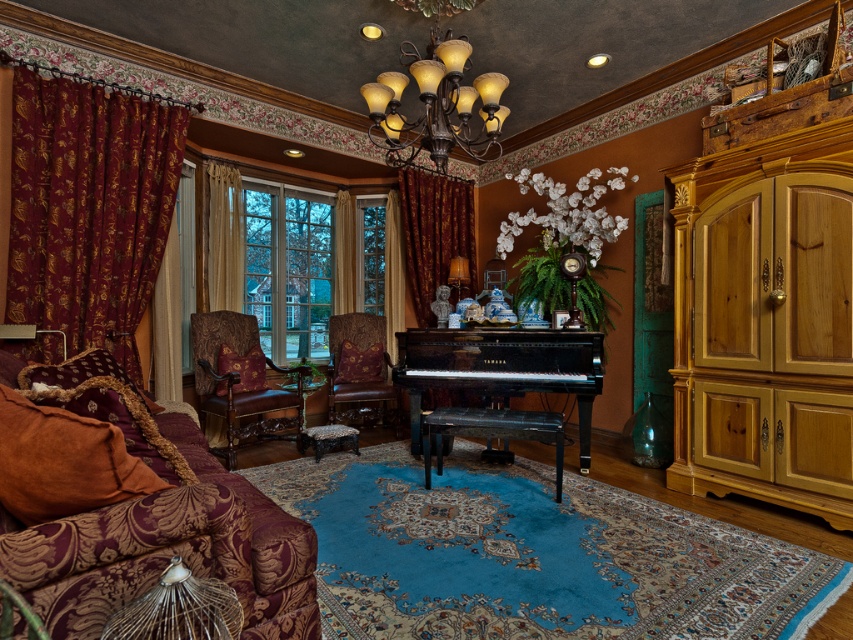
Does light brown wood armoire at right appear over velvet burgundy couch at left?

Correct, light brown wood armoire at right is located above velvet burgundy couch at left.

Who is more distant from viewer, (724,397) or (252,624)?

Positioned behind is point (724,397).

Is point (706, 204) farther from camera compared to point (93, 609)?

That is True.

Image resolution: width=853 pixels, height=640 pixels. Find the location of `light brown wood armoire at right`. light brown wood armoire at right is located at coordinates pyautogui.click(x=764, y=321).

Who is lower down, light brown wood armoire at right or velvet burgundy curtain at center?

light brown wood armoire at right

Does light brown wood armoire at right appear over velvet burgundy curtain at center?

Incorrect, light brown wood armoire at right is not positioned above velvet burgundy curtain at center.

This screenshot has width=853, height=640. What do you see at coordinates (764, 321) in the screenshot?
I see `light brown wood armoire at right` at bounding box center [764, 321].

In order to click on light brown wood armoire at right in this screenshot , I will do `click(764, 321)`.

Between point (219, 237) and point (155, 330), which one is positioned behind?

The point (219, 237) is behind.

Between point (210, 164) and point (154, 371), which one is positioned in front?

Point (154, 371) is more forward.

The width and height of the screenshot is (853, 640). Find the location of `beige fabric curtain at center`. beige fabric curtain at center is located at coordinates (224, 237).